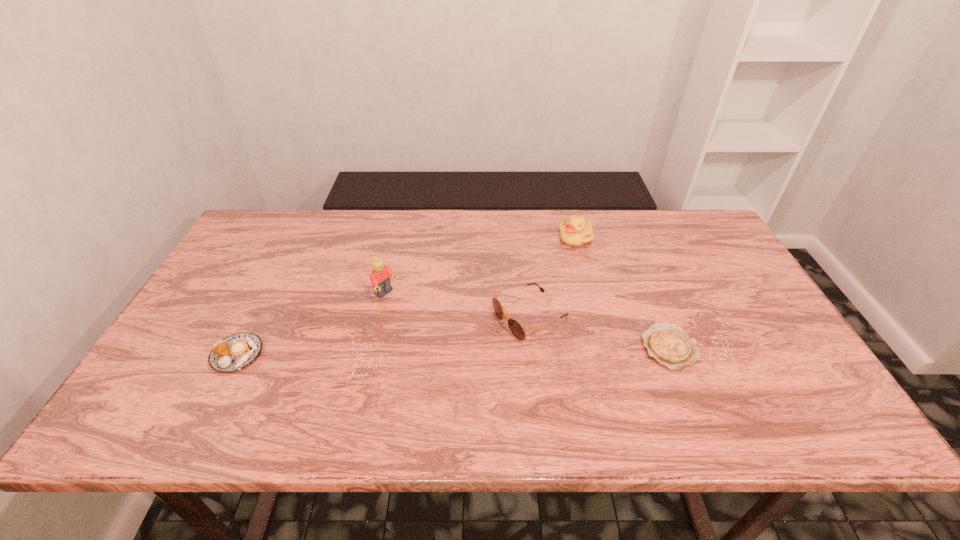
The height and width of the screenshot is (540, 960). In the image, there is a desktop. In order to click on vacant space at the far left corner in this screenshot , I will do `click(247, 242)`.

I want to click on vacant space at the near left corner of the desktop, so click(x=161, y=386).

Find the location of a particular element. The width and height of the screenshot is (960, 540). vacant area at the far right corner of the desktop is located at coordinates (730, 254).

Where is `empty space between the fourth tallest object and the sunglasses`? This screenshot has height=540, width=960. empty space between the fourth tallest object and the sunglasses is located at coordinates (384, 336).

The width and height of the screenshot is (960, 540). What are the coordinates of `blank region between the duckling and the rightmost object` in the screenshot? It's located at (623, 292).

At what (x,y) coordinates should I click in order to perform the action: click on free space between the third shortest object and the Lego. Please return your answer as a coordinate pair (x, y). Looking at the image, I should click on (458, 306).

The width and height of the screenshot is (960, 540). In order to click on empty space that is in between the pastry and the tallest object in this screenshot , I will do `click(312, 325)`.

Identify the location of unoccupied area between the shortest object and the sunglasses. This screenshot has height=540, width=960. (600, 332).

I want to click on unoccupied position between the second tallest object and the second shortest object, so click(x=407, y=297).

Identify the location of free spot between the tallest object and the fourth object from left to right. The width and height of the screenshot is (960, 540). (481, 266).